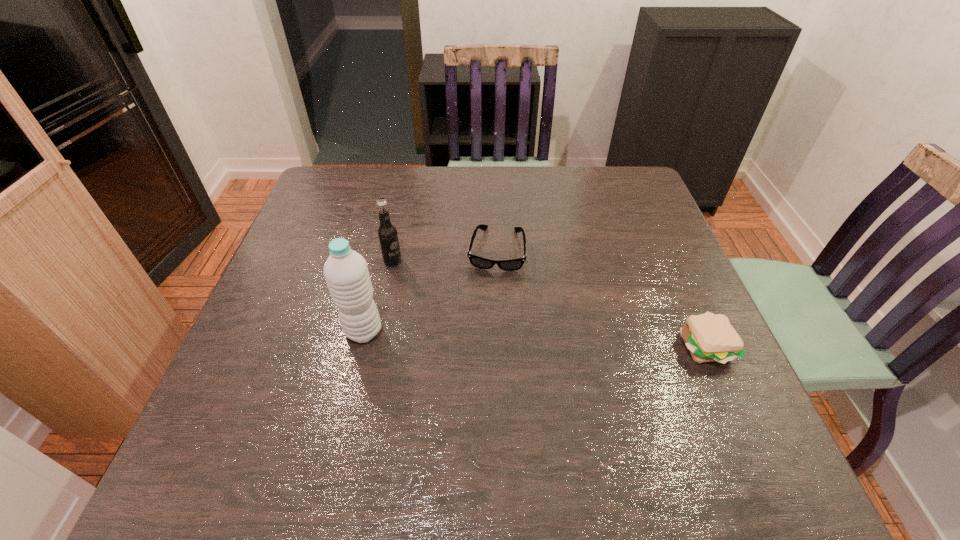
Identify which object is the third nearest to the shortest object. Please provide its 2D coordinates. Your answer should be formatted as a tuple, i.e. [(x, y)], where the tuple contains the x and y coordinates of a point satisfying the conditions above.

[(709, 337)]

Where is `free spot that satisfies the following two spatial constraints: 1. on the front side of the patty; 2. on the left side of the water bottle`? The width and height of the screenshot is (960, 540). free spot that satisfies the following two spatial constraints: 1. on the front side of the patty; 2. on the left side of the water bottle is located at coordinates (360, 346).